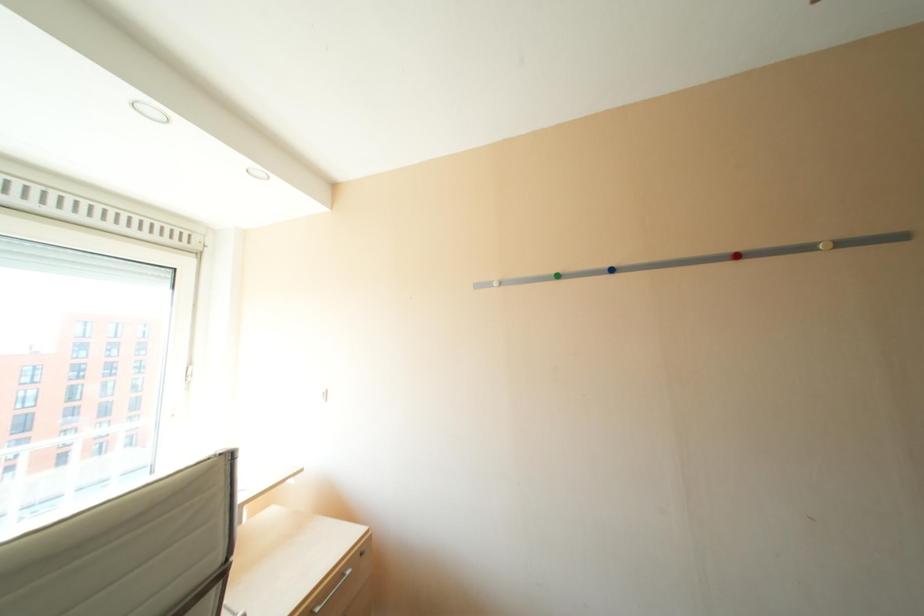
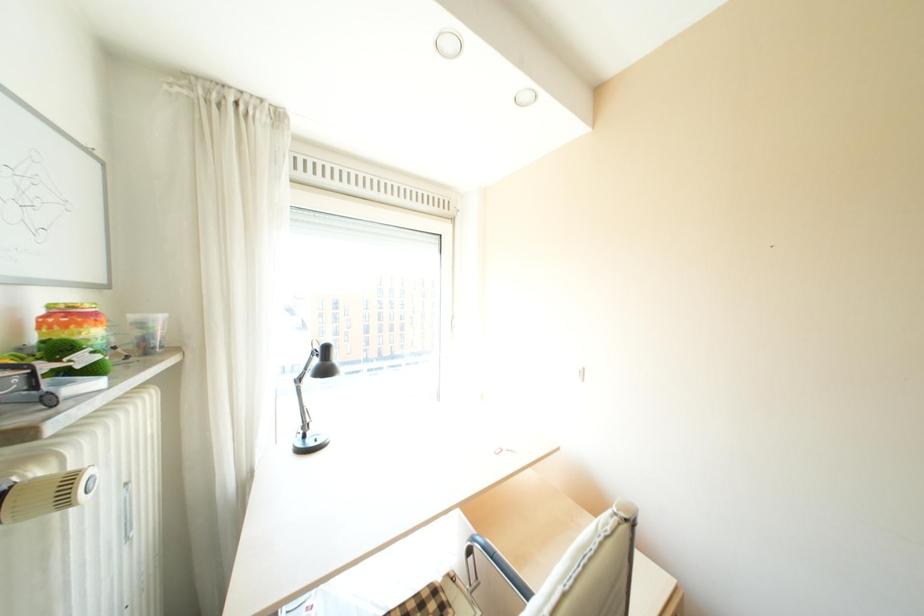
Question: The camera is either moving clockwise (left) or counter-clockwise (right) around the object. The first image is from the beginning of the video and the second image is from the end. Is the camera moving left or right when shooting the video?

Choices:
 (A) Left
 (B) Right

Answer: (B)